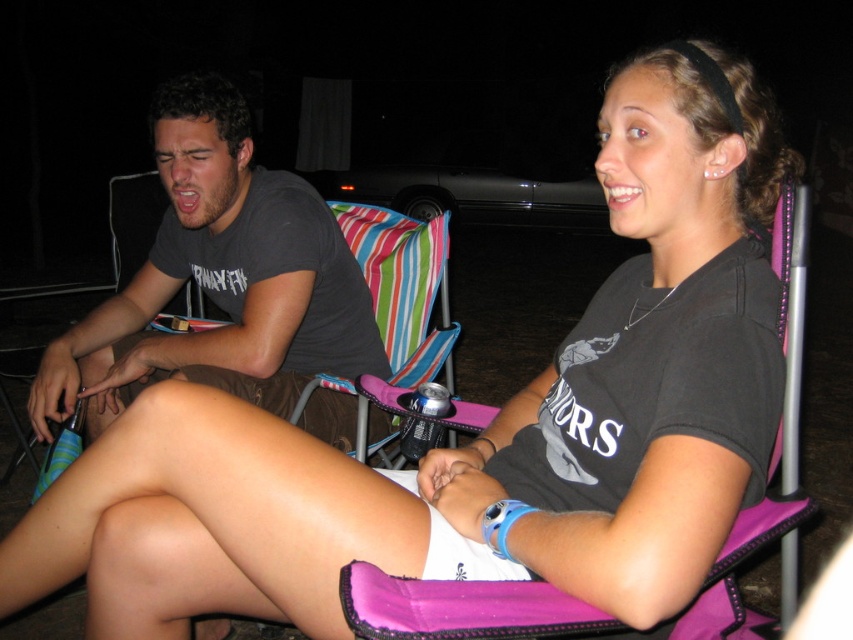
Based on the coordinates given, which object is located at point (x=219, y=278)?

The point (x=219, y=278) indicates the dark gray t shirt at left.